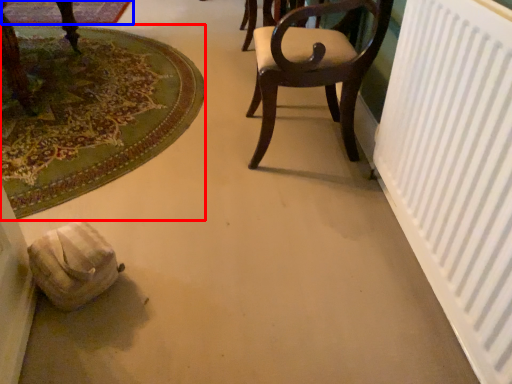
Question: Among these objects, which one is farthest to the camera, mat (highlighted by a red box) or mat (highlighted by a blue box)?

Choices:
 (A) mat
 (B) mat

Answer: (B)